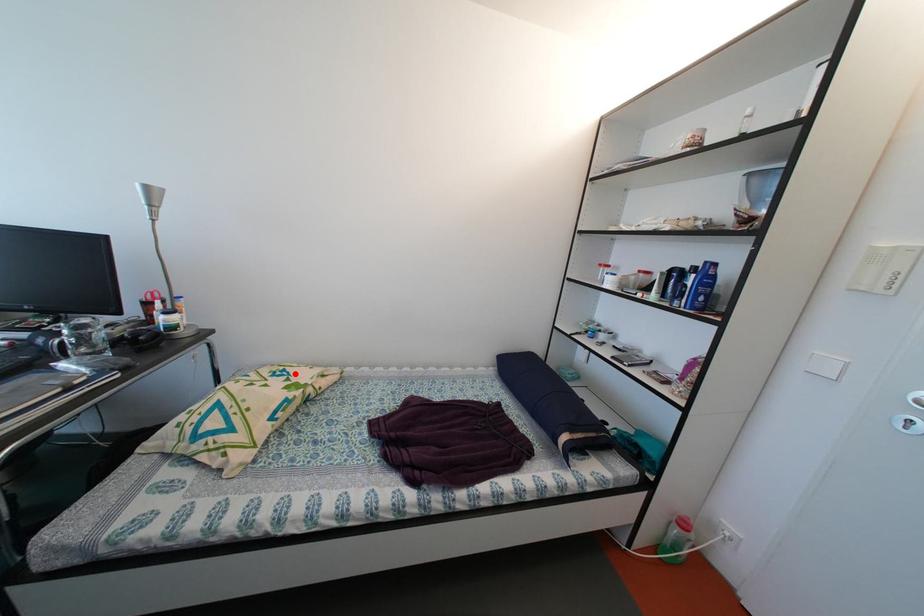
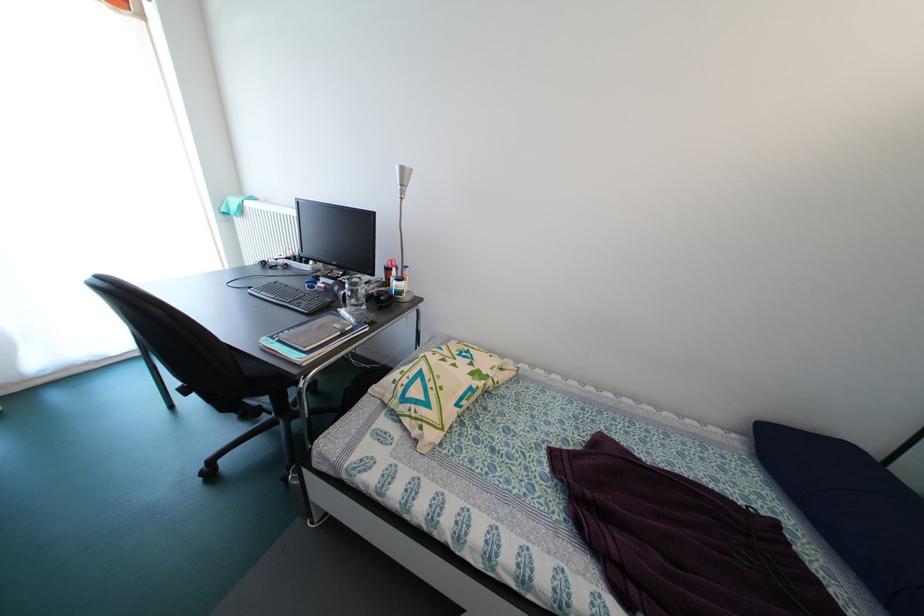
Where in the second image is the point corresponding to the highlighted location from the first image?

(479, 355)